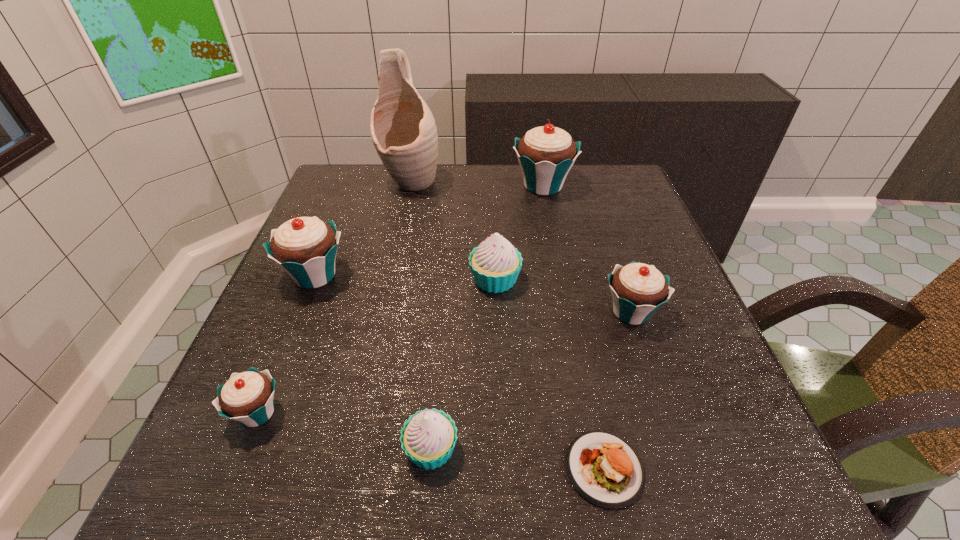
Locate an element on the screen. The width and height of the screenshot is (960, 540). the third cupcake from left to right is located at coordinates (428, 438).

At what (x,y) coordinates should I click in order to perform the action: click on patty (food). Please return your answer as a coordinate pair (x, y). Image resolution: width=960 pixels, height=540 pixels. Looking at the image, I should click on (606, 470).

The width and height of the screenshot is (960, 540). I want to click on vacant point located at the spout of the pitcher, so click(x=388, y=291).

I want to click on vacant space located on the front of the seventh shortest object, so click(558, 260).

Identify the location of vacant space located 0.200m on the right of the third tallest object. (444, 275).

Identify the location of blank area located 0.180m on the right of the right white cupcake. This screenshot has width=960, height=540. (607, 280).

At what (x,y) coordinates should I click in order to perform the action: click on vacant position located 0.140m on the left of the third biggest teal cupcake. Please return your answer as a coordinate pair (x, y). Looking at the image, I should click on (530, 312).

This screenshot has width=960, height=540. Find the location of `vacant point located 0.060m on the right of the smallest teal cupcake`. vacant point located 0.060m on the right of the smallest teal cupcake is located at coordinates (323, 413).

At what (x,y) coordinates should I click in order to perform the action: click on free space located 0.340m on the right of the left white cupcake. Please return your answer as a coordinate pair (x, y). Image resolution: width=960 pixels, height=540 pixels. Looking at the image, I should click on (686, 449).

The width and height of the screenshot is (960, 540). I want to click on free spot located 0.190m on the left of the patty (food), so click(x=434, y=468).